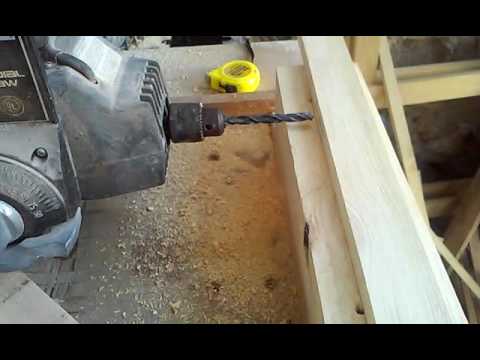
Where is `yellow tape measureer`? The height and width of the screenshot is (360, 480). yellow tape measureer is located at coordinates (246, 81).